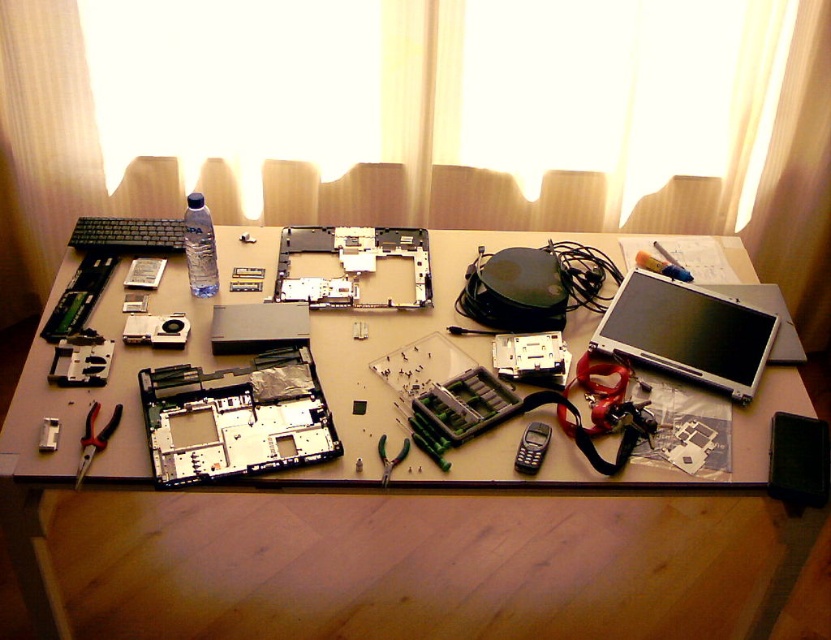
You need to place both the matte plastic motherboard at center and the matte silver laptop at center into a storage box that can only accommodate items up to the size of the larger object. Which object determines the minimum required box size?

The matte plastic motherboard at center determines the minimum required box size because its width is larger than the matte silver laptop at center.

You are organizing the items on the table and need to place the matte plastic motherboard at center and the matte silver laptop at center into a storage box. If the box can only fit one of them, which item should you prioritize placing first?

The matte plastic motherboard at center is bigger than the matte silver laptop at center, so you should prioritize placing the matte silver laptop at center first to ensure it fits in the box.

You are an electronics technician who needs to assemble a laptop. You have the matte plastic motherboard at center on the table and another component. How far apart are they?

The matte plastic motherboard at center and the other component are 4.99 feet apart.